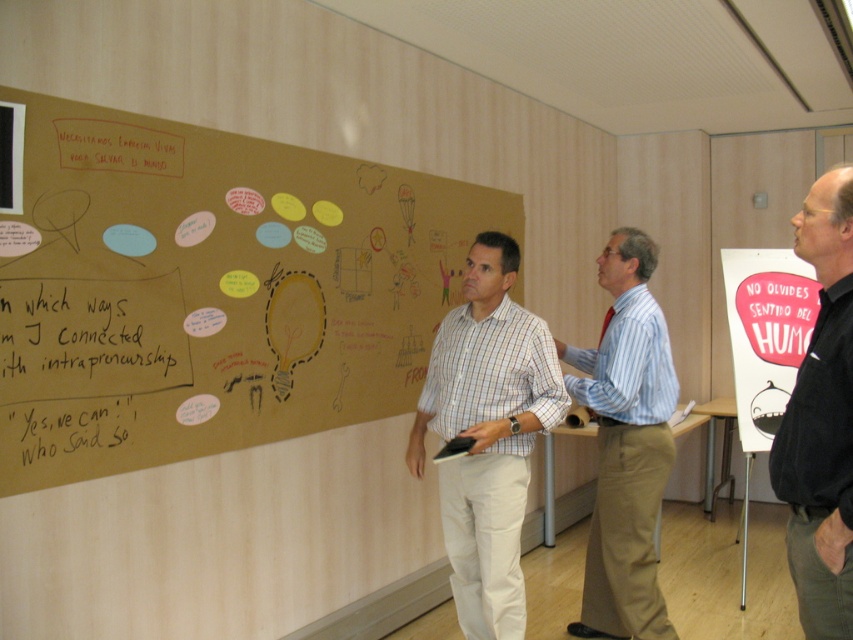
Between light blue striped shirt at center and black cotton shirt at right, which one appears on the right side from the viewer's perspective?

Positioned to the right is black cotton shirt at right.

Is light blue striped shirt at center shorter than black cotton shirt at right?

No, light blue striped shirt at center is not shorter than black cotton shirt at right.

Image resolution: width=853 pixels, height=640 pixels. I want to click on light blue striped shirt at center, so click(625, 445).

Is black cotton shirt at right wider than white chalk writing at left?

No.

Does black cotton shirt at right have a larger size compared to white chalk writing at left?

Yes.

The image size is (853, 640). Find the location of `black cotton shirt at right`. black cotton shirt at right is located at coordinates (821, 420).

Is point (466, 608) closer to camera compared to point (80, 339)?

No.

Is plaid cotton shirt at center wider than white chalk writing at left?

Yes, plaid cotton shirt at center is wider than white chalk writing at left.

Locate an element on the screen. This screenshot has width=853, height=640. plaid cotton shirt at center is located at coordinates (486, 433).